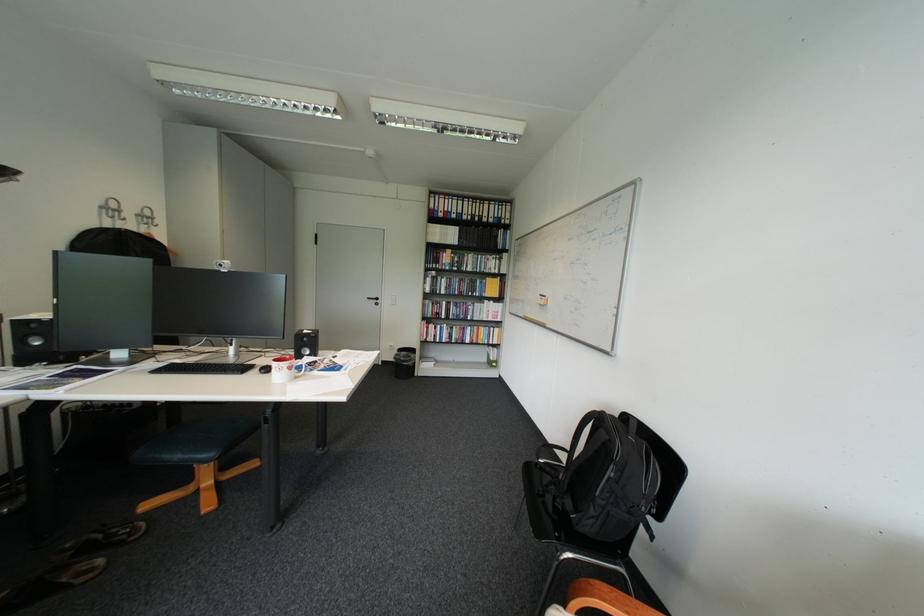
Where would you lift the black backpack? Please return your answer as a coordinate pair (x, y).

(613, 490)